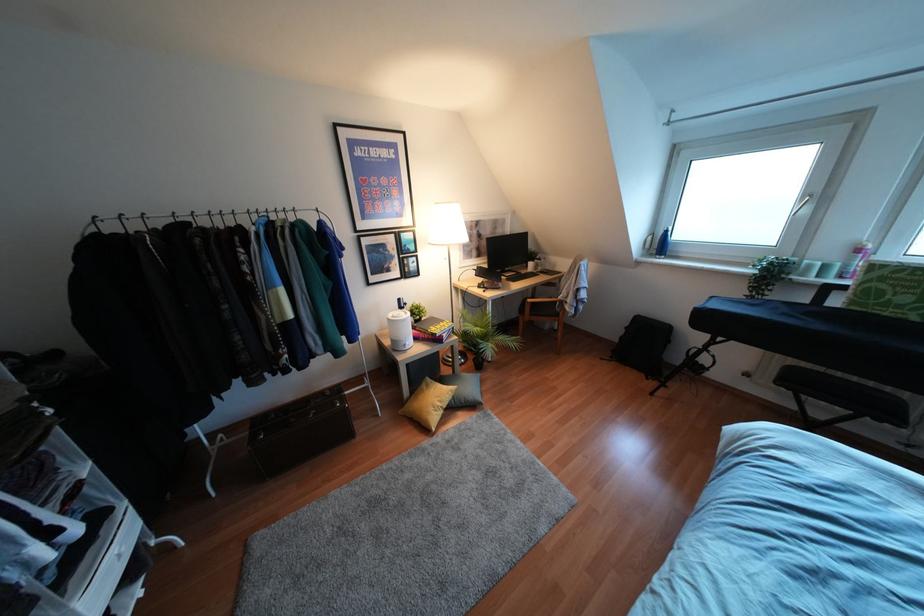
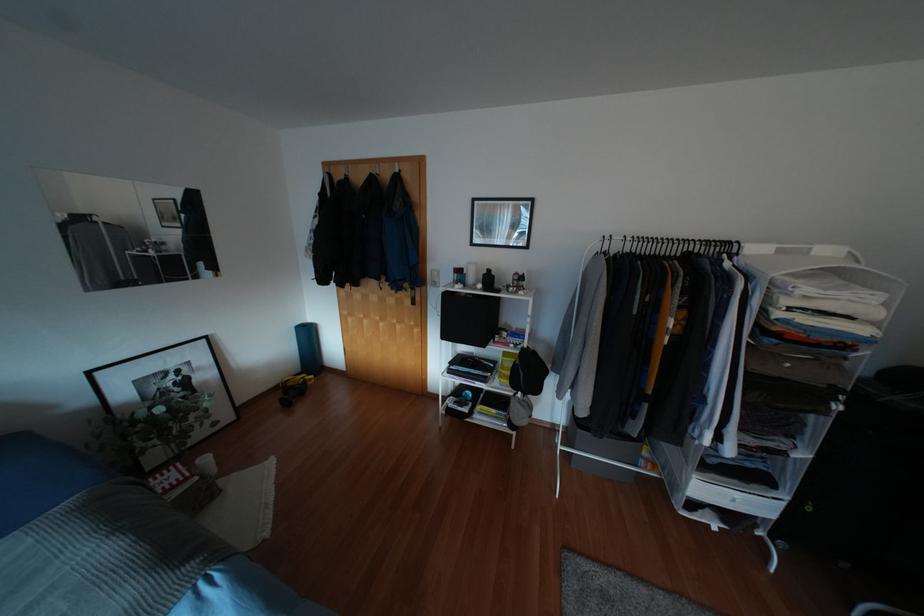
The point at (118, 554) is marked in the first image. Where is the corresponding point in the second image?

(734, 500)